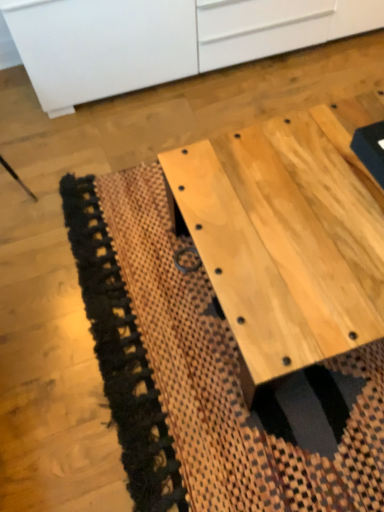
Question: Does white matte cabinet at upper center lie behind natural wood table at center?

Choices:
 (A) no
 (B) yes

Answer: (B)

Question: From the image's perspective, is white matte cabinet at upper center located above natural wood table at center?

Choices:
 (A) yes
 (B) no

Answer: (A)

Question: Is white matte cabinet at upper center not within natural wood table at center?

Choices:
 (A) yes
 (B) no

Answer: (A)

Question: Can you confirm if white matte cabinet at upper center is positioned to the left of natural wood table at center?

Choices:
 (A) yes
 (B) no

Answer: (A)

Question: Would you say white matte cabinet at upper center contains natural wood table at center?

Choices:
 (A) yes
 (B) no

Answer: (B)

Question: Is white matte cabinet at upper center closer to the viewer compared to natural wood table at center?

Choices:
 (A) yes
 (B) no

Answer: (B)

Question: Is natural wood table at center oriented towards white matte cabinet at upper center?

Choices:
 (A) no
 (B) yes

Answer: (A)

Question: Would you say natural wood table at center contains white matte cabinet at upper center?

Choices:
 (A) yes
 (B) no

Answer: (B)

Question: Is natural wood table at center oriented away from white matte cabinet at upper center?

Choices:
 (A) yes
 (B) no

Answer: (A)

Question: Is natural wood table at center directly adjacent to white matte cabinet at upper center?

Choices:
 (A) yes
 (B) no

Answer: (B)

Question: From a real-world perspective, is natural wood table at center physically above white matte cabinet at upper center?

Choices:
 (A) yes
 (B) no

Answer: (B)

Question: Can we say natural wood table at center lies outside white matte cabinet at upper center?

Choices:
 (A) no
 (B) yes

Answer: (B)

Question: Can you see natural wood table at center touching natural woven mat at center?

Choices:
 (A) yes
 (B) no

Answer: (B)